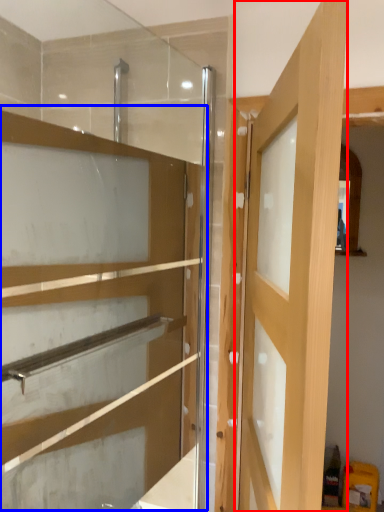
Question: Which object appears closest to the camera in this image, door (highlighted by a red box) or cabinetry (highlighted by a blue box)?

Choices:
 (A) door
 (B) cabinetry

Answer: (A)